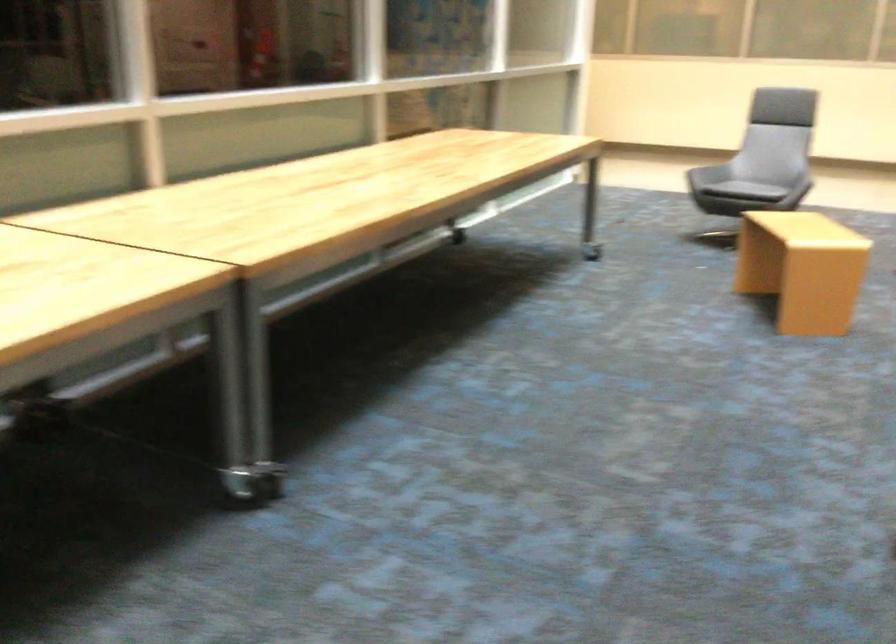
Looking at this image, the first image is from the beginning of the video and the second image is from the end. How did the camera likely rotate when shooting the video?

The camera rotated toward right-down.